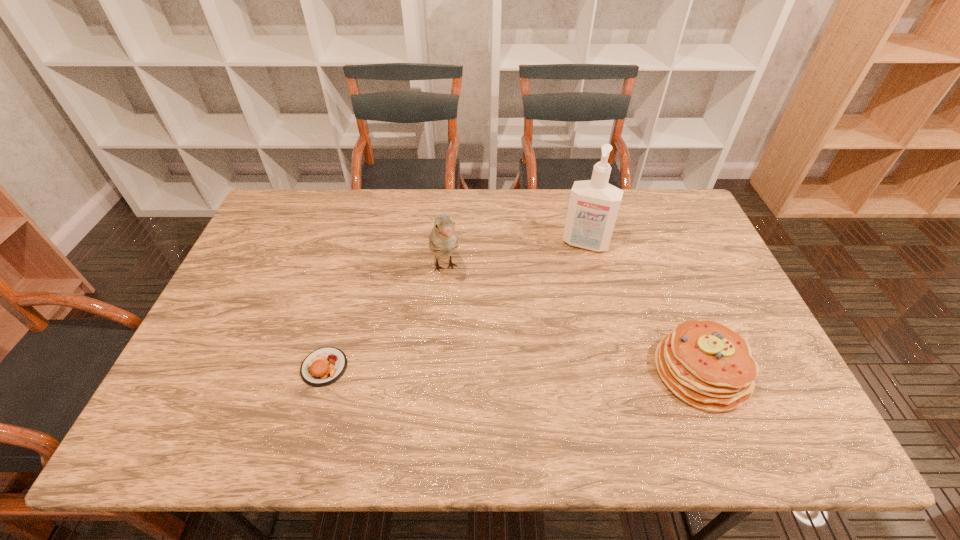
This screenshot has height=540, width=960. I want to click on free spot on the desktop that is between the leftmost object and the rightmost object and is positioned on the front label of the cleansing agent, so click(x=547, y=369).

Locate an element on the screen. vacant space on the desktop that is between the shortest object and the pancake and is positioned at the face of the second object from left to right is located at coordinates (480, 369).